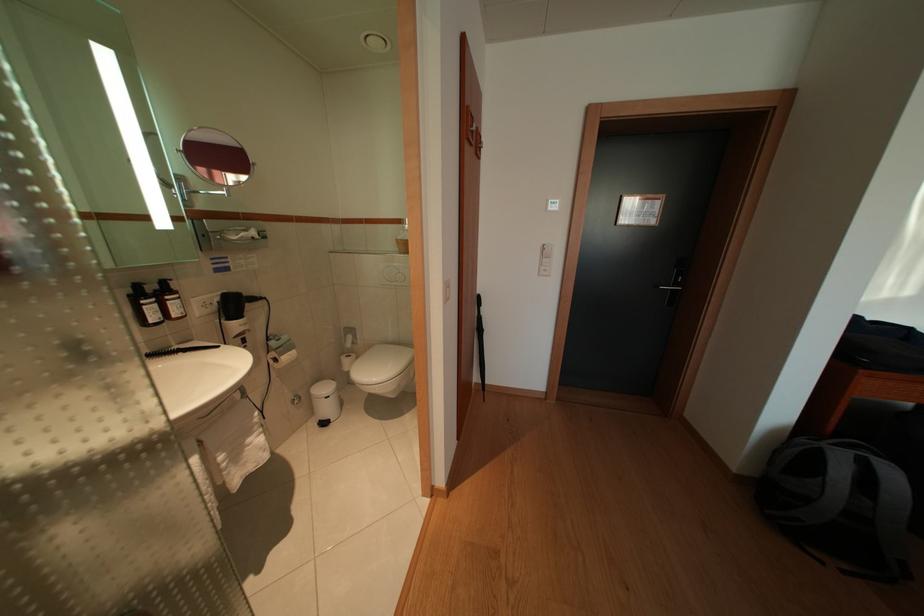
Image resolution: width=924 pixels, height=616 pixels. Describe the element at coordinates (381, 363) in the screenshot. I see `a white toilet lid` at that location.